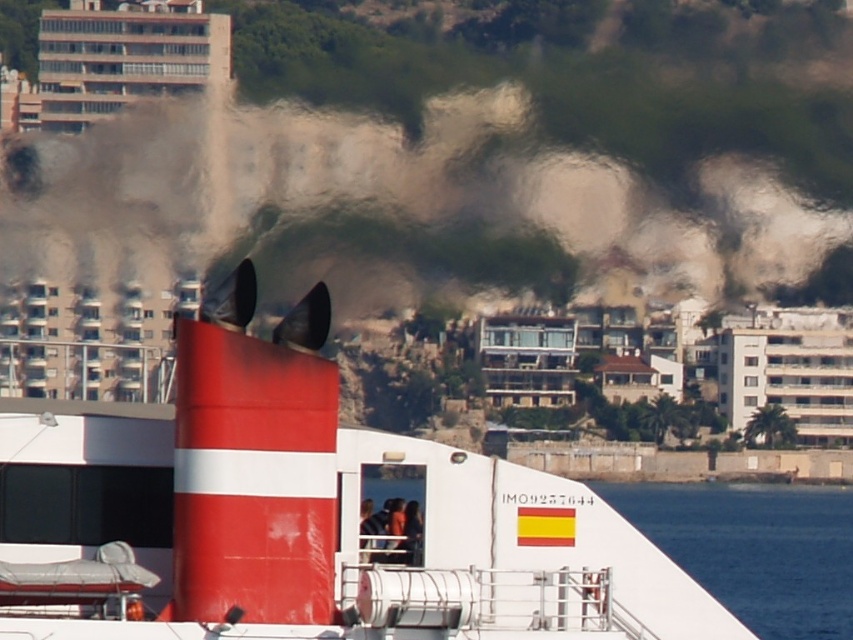
Question: In this image, where is smooth red and white boat at center located relative to white glossy water at lower right?

Choices:
 (A) below
 (B) above

Answer: (B)

Question: Which object is closer to the camera taking this photo?

Choices:
 (A) white glossy water at lower right
 (B) smooth red and white boat at center
 (C) black matte smoke at upper center

Answer: (B)

Question: Is smooth red and white boat at center below white glossy water at lower right?

Choices:
 (A) yes
 (B) no

Answer: (B)

Question: Which point appears closest to the camera in this image?

Choices:
 (A) (357, 496)
 (B) (462, 266)
 (C) (740, 497)

Answer: (A)

Question: In this image, where is smooth red and white boat at center located relative to white glossy water at lower right?

Choices:
 (A) right
 (B) left

Answer: (B)

Question: Which point is farther from the camera taking this photo?

Choices:
 (A) (784, 572)
 (B) (79, 563)

Answer: (A)